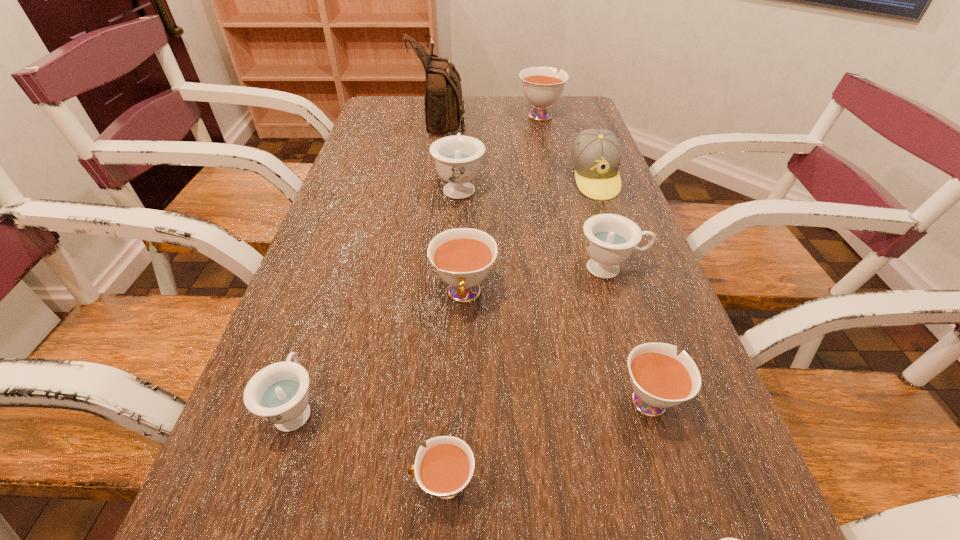
What are the coordinates of `teacup at the far edge` in the screenshot? It's located at (542, 87).

In order to click on object that is at the left edge in this screenshot , I will do `click(279, 394)`.

This screenshot has width=960, height=540. I want to click on baseball cap present at the right edge, so click(596, 154).

Locate an element on the screen. object that is at the far right corner is located at coordinates (542, 87).

At what (x,y) coordinates should I click in order to perform the action: click on blank space at the far edge of the desktop. Please return your answer as a coordinate pair (x, y). The image size is (960, 540). Looking at the image, I should click on (520, 114).

Identify the location of blank area at the left edge. The width and height of the screenshot is (960, 540). (353, 181).

In the image, there is a desktop. Where is `blank space at the right edge`? blank space at the right edge is located at coordinates (609, 365).

Locate an element on the screen. This screenshot has height=540, width=960. free region at the far left corner is located at coordinates (412, 106).

At what (x,y) coordinates should I click in order to perform the action: click on vacant space at the far right corner of the desktop. Please return your answer as a coordinate pair (x, y). Looking at the image, I should click on (578, 116).

Image resolution: width=960 pixels, height=540 pixels. Identify the location of unoccupied position between the biggest blue teacup and the biggest white teacup. (499, 151).